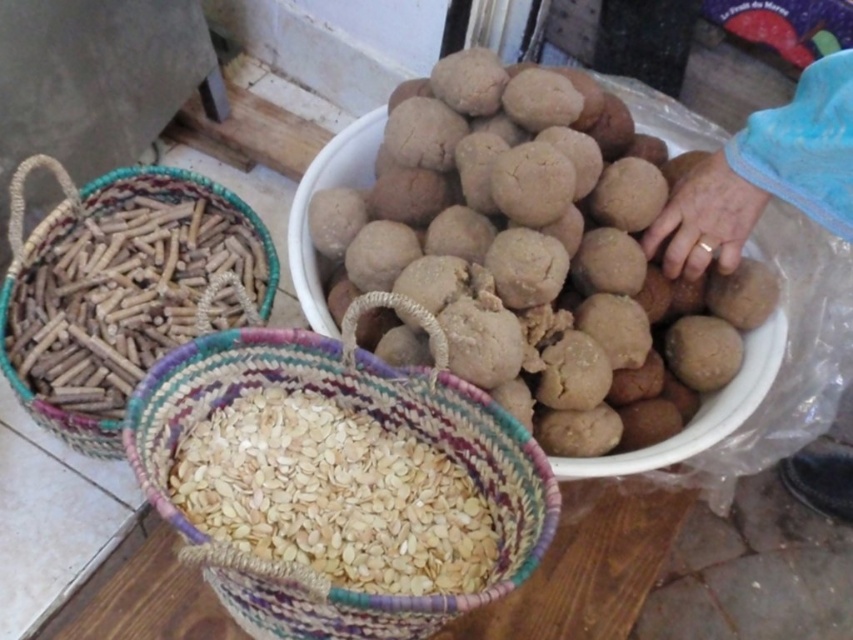
You are a customer at the market stall looking for the light brown woven basket at lower center and the brown woven basket at left. According to the arrangement, which basket is positioned lower in the image?

The light brown woven basket at lower center is positioned lower than the brown woven basket at left.

You are a customer at the market stall and want to choose between the braided straw basket filled with seeds at center and the light brown woven basket at lower center. Which basket is wider?

The braided straw basket filled with seeds at center is wider than the light brown woven basket at lower center according to the description.